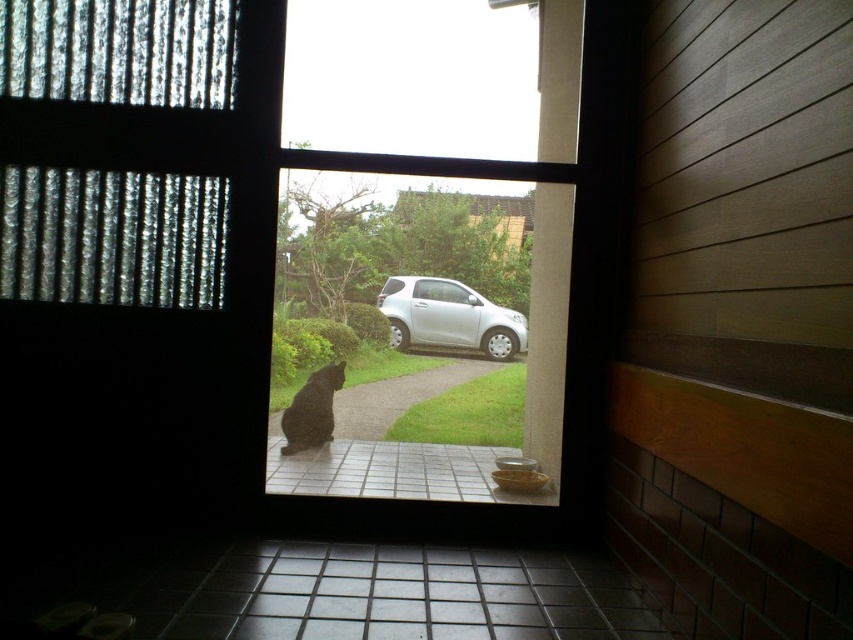
Question: Which of the following is the closest to the observer?

Choices:
 (A) (285, 422)
 (B) (7, 292)
 (C) (506, 324)
 (D) (366, 451)

Answer: (B)

Question: Is transparent glass window at center above translucent plastic curtain at upper left?

Choices:
 (A) yes
 (B) no

Answer: (A)

Question: Which object is farther from the camera taking this photo?

Choices:
 (A) black fur cat at center
 (B) transparent glass window at center

Answer: (B)

Question: Does translucent plastic curtain at upper left lie in front of black fur cat at center?

Choices:
 (A) no
 (B) yes

Answer: (B)

Question: Which point appears closest to the camera in this image?

Choices:
 (A) (7, 48)
 (B) (453, 330)
 (C) (506, 70)
 (D) (317, 392)

Answer: (A)

Question: Is silver metallic car at center bigger than black fur cat at center?

Choices:
 (A) no
 (B) yes

Answer: (A)